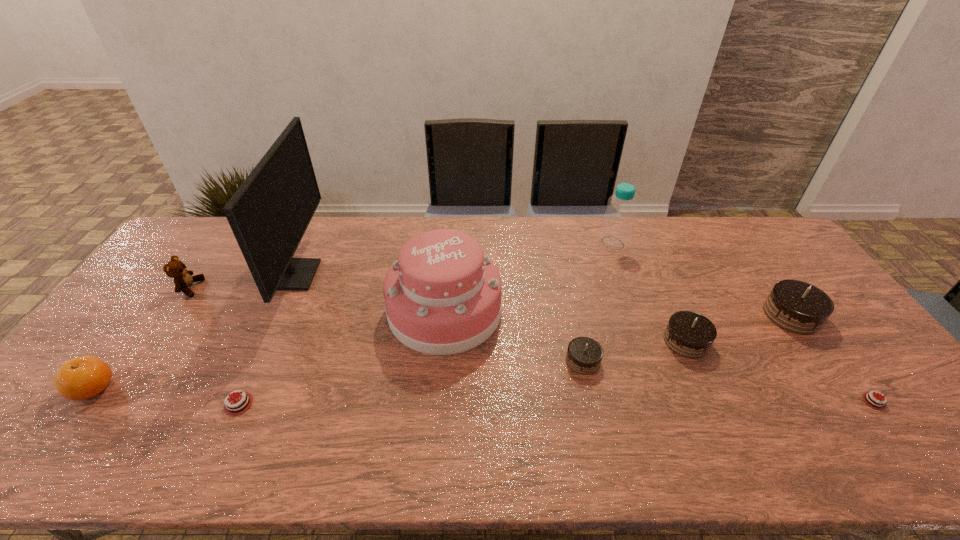
Image resolution: width=960 pixels, height=540 pixels. I want to click on the tallest object, so click(x=269, y=213).

Locate an element on the screen. blue bottle is located at coordinates (617, 224).

Image resolution: width=960 pixels, height=540 pixels. Find the location of `pink birthday cake`. pink birthday cake is located at coordinates (442, 296).

I want to click on birthday cake, so click(x=442, y=296).

You are a GUI agent. You are given a task and a screenshot of the screen. Output one action in this format:
    pyautogui.click(x=<x>, y=<y>)
    Task: Click on the biggest chocolate chocolate cake
    This screenshot has width=960, height=540.
    Given the screenshot: What is the action you would take?
    pyautogui.click(x=796, y=306)

What are the coordinates of `the rightmost chocolate chocolate cake` in the screenshot? It's located at (796, 306).

Image resolution: width=960 pixels, height=540 pixels. I want to click on brown teddy bear, so click(x=176, y=269).

I want to click on the second tallest chocolate cake, so click(689, 334).

Where is `the third chocolate cake from left to right`? Image resolution: width=960 pixels, height=540 pixels. the third chocolate cake from left to right is located at coordinates (689, 334).

I want to click on clementine, so click(81, 378).